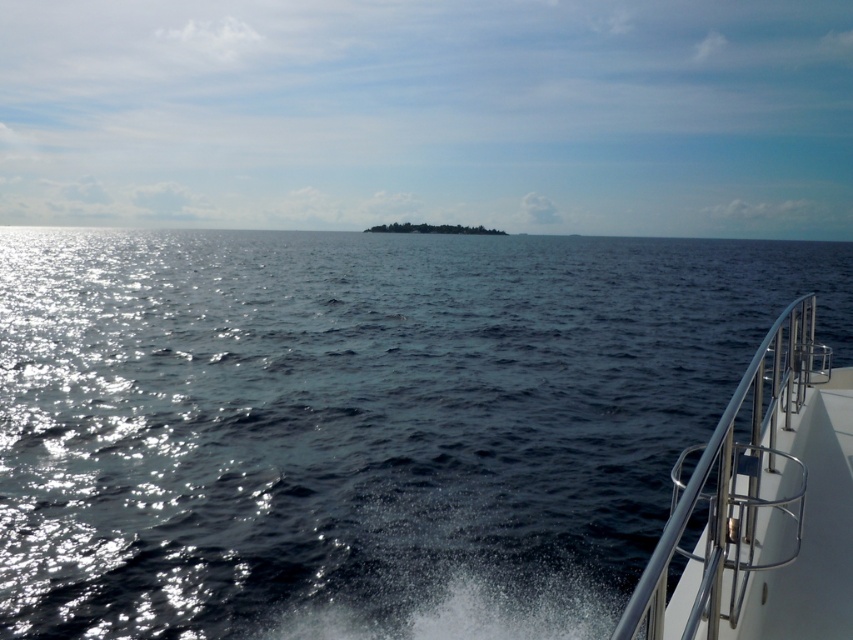
Question: Among these points, which one is nearest to the camera?

Choices:
 (A) (432, 282)
 (B) (682, 496)

Answer: (B)

Question: Which object appears closest to the camera in this image?

Choices:
 (A) glistening blue water at center
 (B) white metallic railing at right

Answer: (B)

Question: Is glistening blue water at center positioned in front of white metallic railing at right?

Choices:
 (A) yes
 (B) no

Answer: (B)

Question: Where is glistening blue water at center located in relation to white metallic railing at right in the image?

Choices:
 (A) right
 (B) left

Answer: (A)

Question: From the image, what is the correct spatial relationship of glistening blue water at center in relation to white metallic railing at right?

Choices:
 (A) below
 (B) above

Answer: (B)